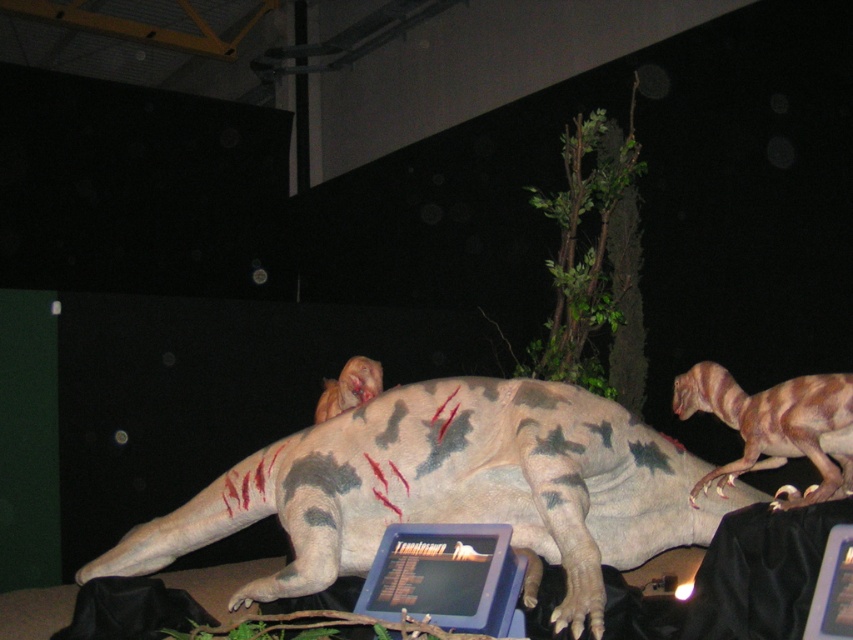
Question: Can you confirm if brown textured dinosaur at right is positioned below brown textured dinosaur head at center?

Choices:
 (A) no
 (B) yes

Answer: (B)

Question: Which point is farther from the camera taking this photo?

Choices:
 (A) (746, 436)
 (B) (445, 522)

Answer: (B)

Question: Which of these objects is positioned closest to the blue plastic laptop at center?

Choices:
 (A) brown textured dinosaur at right
 (B) camouflage-patterned dinosaur at center

Answer: (B)

Question: Does brown textured dinosaur at right appear on the left side of brown textured dinosaur head at center?

Choices:
 (A) no
 (B) yes

Answer: (A)

Question: Is camouflage-patterned dinosaur at center above brown textured dinosaur at right?

Choices:
 (A) no
 (B) yes

Answer: (A)

Question: Which point is closer to the camera?

Choices:
 (A) blue plastic laptop at center
 (B) camouflage-patterned dinosaur at center
 (C) brown textured dinosaur head at center
 (D) brown textured dinosaur at right

Answer: (A)